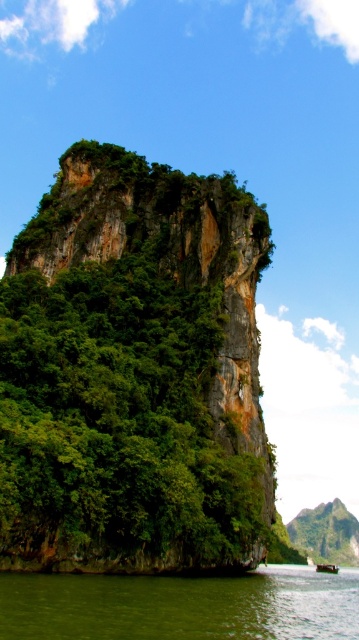
Is point (193, 452) positioned in front of point (329, 568)?

That is True.

Looking at this image, which is below, green rocky cliff at center or metallic gray boat at center?

metallic gray boat at center

This screenshot has height=640, width=359. Find the location of `green rocky cliff at center`. green rocky cliff at center is located at coordinates (133, 372).

Identify the location of green rocky cliff at center. (133, 372).

Between point (355, 570) and point (337, 568), which one is positioned in front?

Point (337, 568)

Does point (160, 621) lie behind point (330, 566)?

No, it is not.

Locate an element on the screen. This screenshot has width=359, height=640. green liquid water at lower center is located at coordinates (182, 605).

Who is more forward, (67, 273) or (26, 602)?

Point (26, 602) is more forward.

Between green rocky cliff at center and green liquid water at lower center, which one is positioned lower?

green liquid water at lower center is below.

The image size is (359, 640). What do you see at coordinates (133, 372) in the screenshot?
I see `green rocky cliff at center` at bounding box center [133, 372].

At what (x,y) coordinates should I click in order to perform the action: click on green rocky cliff at center. Please return your answer as a coordinate pair (x, y). Looking at the image, I should click on (133, 372).